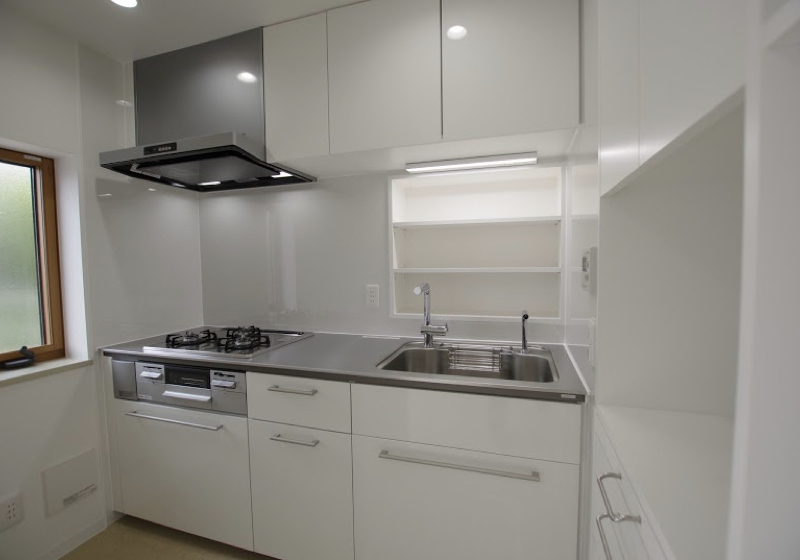
This screenshot has width=800, height=560. In order to click on light in this screenshot , I will do `click(470, 166)`, `click(472, 372)`.